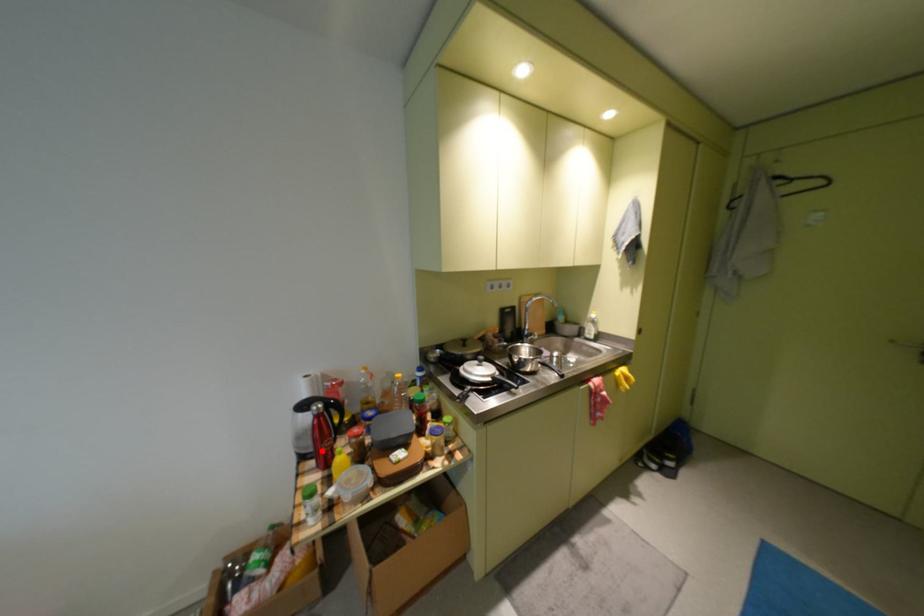
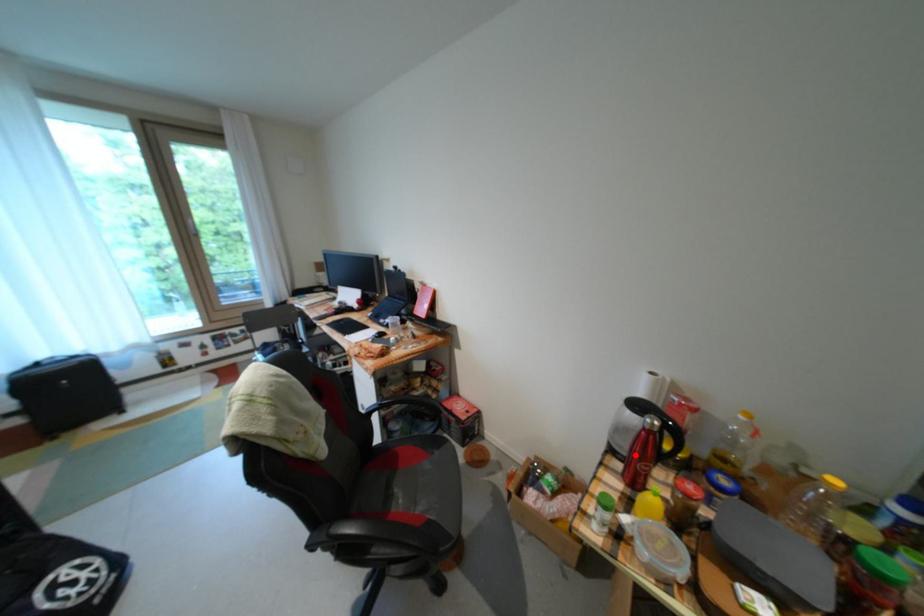
I am providing you with two images of the same scene from different viewpoints. A red point is marked on the first image and another point is marked on the second image. Is the red point in image1 aligned with the point shown in image2?

Yes